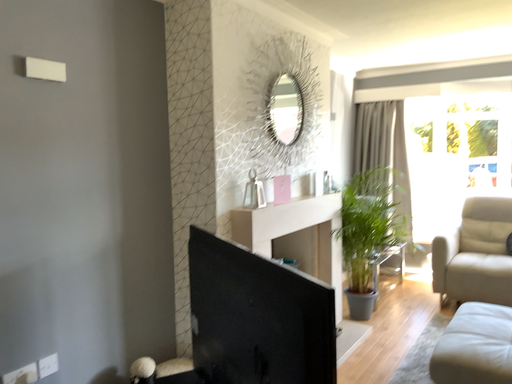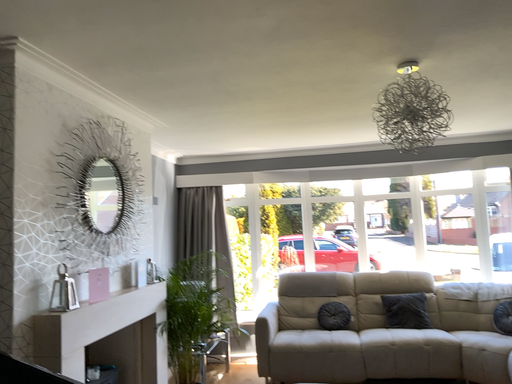
Question: How did the camera likely rotate when shooting the video?

Choices:
 (A) rotated right
 (B) rotated left

Answer: (A)